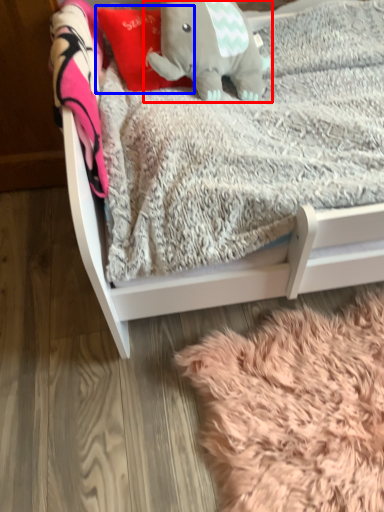
Question: Which object appears farthest to the camera in this image, elephant (highlighted by a red box) or throw pillow (highlighted by a blue box)?

Choices:
 (A) elephant
 (B) throw pillow

Answer: (B)